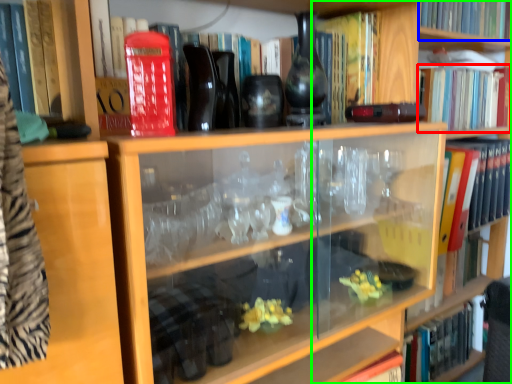
Question: Estimate the real-world distances between objects in this image. Which object is farther from book (highlighted by a red box), book (highlighted by a blue box) or bookshelf (highlighted by a green box)?

Choices:
 (A) book
 (B) bookshelf

Answer: (B)